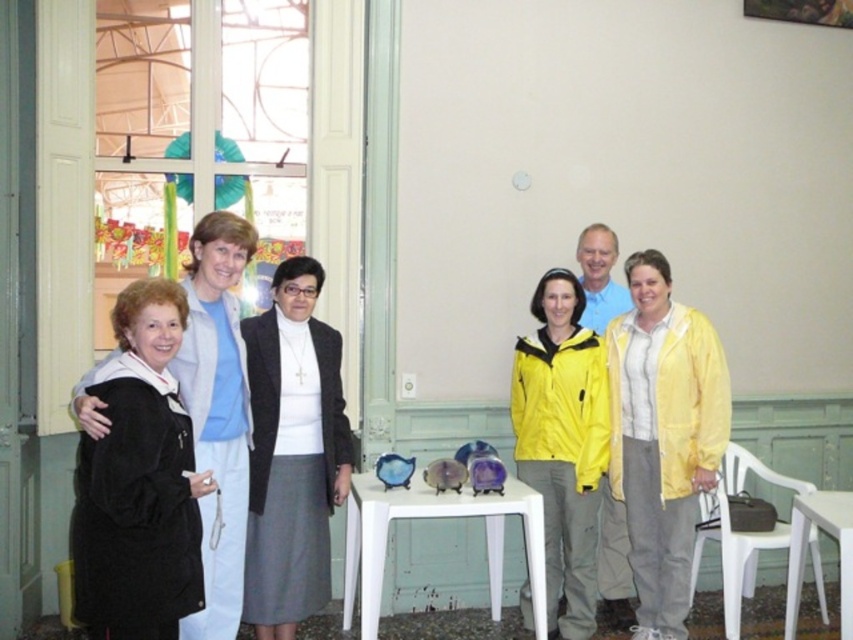
Question: Estimate the real-world distances between objects in this image. Which object is farther from the black matte jacket at left?

Choices:
 (A) white plastic chair at lower right
 (B) black matte jacket at center
 (C) white plastic table at center
 (D) white plastic table at lower right

Answer: (D)

Question: Is black velvet coat at left positioned at the back of white plastic table at lower right?

Choices:
 (A) no
 (B) yes

Answer: (A)

Question: Which object is positioned farthest from the white plastic chair at lower right?

Choices:
 (A) white plastic table at lower right
 (B) white plastic table at center
 (C) black velvet coat at left
 (D) black matte jacket at left

Answer: (C)

Question: Based on their relative distances, which object is farther from the black matte jacket at left?

Choices:
 (A) yellow matte jacket at center
 (B) black velvet coat at left
 (C) white plastic table at lower right
 (D) white plastic chair at lower right

Answer: (C)

Question: Can you confirm if yellow matte jacket at center is positioned to the left of white plastic table at lower right?

Choices:
 (A) yes
 (B) no

Answer: (A)

Question: Does yellow matte jacket at center appear over white plastic table at center?

Choices:
 (A) no
 (B) yes

Answer: (B)